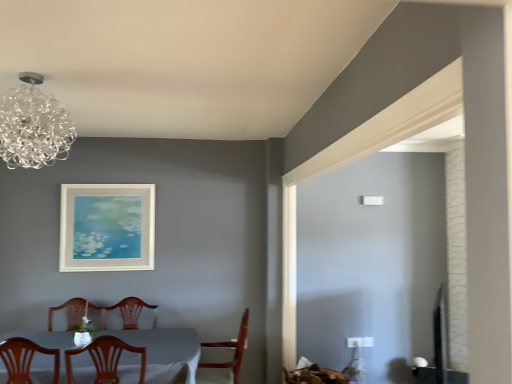
Image resolution: width=512 pixels, height=384 pixels. Find the location of `white glossy table at lower left`. white glossy table at lower left is located at coordinates (165, 353).

The height and width of the screenshot is (384, 512). I want to click on wooden chair at center, marked as the 2th chair in a right-to-left arrangement, so click(105, 359).

What is the approximate height of wooden chair at center, positioned as the first chair in back-to-front order?

wooden chair at center, positioned as the first chair in back-to-front order, is 26.57 inches tall.

Where is `white glossy table at lower left`? white glossy table at lower left is located at coordinates (165, 353).

Is wooden chair at center, positioned as the first chair in back-to-front order, smaller than transparent glass chandelier at upper left?

No, wooden chair at center, positioned as the first chair in back-to-front order, is not smaller than transparent glass chandelier at upper left.

Considering the relative positions of wooden chair at center, placed as the first chair when sorted from right to left, and transparent glass chandelier at upper left in the image provided, is wooden chair at center, placed as the first chair when sorted from right to left, to the right of transparent glass chandelier at upper left from the viewer's perspective?

Yes, wooden chair at center, placed as the first chair when sorted from right to left, is to the right of transparent glass chandelier at upper left.

Looking at this image, is there a large distance between wooden chair at center, positioned as the first chair in back-to-front order, and transparent glass chandelier at upper left?

That's right, there is a large distance between wooden chair at center, positioned as the first chair in back-to-front order, and transparent glass chandelier at upper left.

Who is smaller, wooden chair at center, placed as the first chair when sorted from right to left, or white matte picture frame at upper center?

Smaller between the two is white matte picture frame at upper center.

From the image's perspective, between wooden chair at center, acting as the 2th chair starting from the left, and white matte picture frame at upper center, who is located below?

wooden chair at center, acting as the 2th chair starting from the left, appears lower in the image.

Is wooden chair at center, acting as the second chair starting from the front, further to camera compared to white matte picture frame at upper center?

That is False.

Does wooden chair at center, marked as the 2th chair in a right-to-left arrangement, turn towards white glossy table at lower left?

Yes.

Is wooden chair at center, the 1th chair positioned from the front, positioned far away from white glossy table at lower left?

Actually, wooden chair at center, the 1th chair positioned from the front, and white glossy table at lower left are a little close together.

Can you confirm if wooden chair at center, the 1th chair when ordered from left to right, is smaller than white glossy table at lower left?

Yes, wooden chair at center, the 1th chair when ordered from left to right, is smaller than white glossy table at lower left.

Where is `table on the left of wooden chair at center, the 1th chair when ordered from left to right`? table on the left of wooden chair at center, the 1th chair when ordered from left to right is located at coordinates (165, 353).

Does point (79, 377) appear closer or farther from the camera than point (24, 98)?

Clearly, point (79, 377) is more distant from the camera than point (24, 98).

Does white glossy table at lower left come behind transparent glass chandelier at upper left?

Yes, white glossy table at lower left is further from the camera.

Is white glossy table at lower left inside or outside of transparent glass chandelier at upper left?

white glossy table at lower left is located beyond the bounds of transparent glass chandelier at upper left.

Looking at the image, does transparent glass chandelier at upper left seem bigger or smaller compared to white matte picture frame at upper center?

Considering their sizes, transparent glass chandelier at upper left takes up more space than white matte picture frame at upper center.

Can we say transparent glass chandelier at upper left lies outside white matte picture frame at upper center?

transparent glass chandelier at upper left is positioned outside white matte picture frame at upper center.

This screenshot has width=512, height=384. In order to click on lamp above the white matte picture frame at upper center (from the image's perspective) in this screenshot , I will do `click(33, 126)`.

Who is taller, transparent glass chandelier at upper left or white matte picture frame at upper center?

white matte picture frame at upper center is taller.

From a real-world perspective, which object stands above the other?

wooden chair at center, acting as the second chair starting from the front.

The width and height of the screenshot is (512, 384). In order to click on table below the wooden chair at center, acting as the 2th chair starting from the left (from a real-world perspective) in this screenshot , I will do `click(165, 353)`.

Based on their sizes in the image, would you say white glossy table at lower left is bigger or smaller than wooden chair at center, positioned as the first chair in back-to-front order?

In the image, white glossy table at lower left appears to be larger than wooden chair at center, positioned as the first chair in back-to-front order.

Is white glossy table at lower left far from wooden chair at center, acting as the second chair starting from the front?

white glossy table at lower left is actually quite close to wooden chair at center, acting as the second chair starting from the front.

Which object is wider, transparent glass chandelier at upper left or white glossy table at lower left?

white glossy table at lower left.

Could you tell me if transparent glass chandelier at upper left is facing white glossy table at lower left?

No, transparent glass chandelier at upper left is not aimed at white glossy table at lower left.

Does transparent glass chandelier at upper left have a larger size compared to white glossy table at lower left?

No.

Which is more to the left, transparent glass chandelier at upper left or white glossy table at lower left?

white glossy table at lower left.

Find the location of `the 2nd chair below when counting from the transparent glass chandelier at upper left (from the image's perspective)`. the 2nd chair below when counting from the transparent glass chandelier at upper left (from the image's perspective) is located at coordinates (225, 362).

The width and height of the screenshot is (512, 384). Identify the location of picture frame behind the wooden chair at center, acting as the second chair starting from the front. (106, 227).

From the image, which object appears to be nearer to white matte picture frame at upper center, wooden chair at center, the second chair viewed from the back, or wooden chair at center, placed as the first chair when sorted from right to left?

The object closer to white matte picture frame at upper center is wooden chair at center, placed as the first chair when sorted from right to left.

Based on the photo, looking at the image, which one is located further to transparent glass chandelier at upper left, white matte picture frame at upper center or white glossy table at lower left?

white matte picture frame at upper center is positioned further to the anchor transparent glass chandelier at upper left.

Considering their positions, is white glossy table at lower left positioned further to wooden chair at center, acting as the 2th chair starting from the left, than wooden chair at center, the 1th chair positioned from the front?

wooden chair at center, the 1th chair positioned from the front, lies further to wooden chair at center, acting as the 2th chair starting from the left, than the other object.

Considering their positions, is white glossy table at lower left positioned closer to transparent glass chandelier at upper left than white matte picture frame at upper center?

Based on the image, white glossy table at lower left appears to be nearer to transparent glass chandelier at upper left.

Looking at the image, which one is located closer to wooden chair at center, positioned as the first chair in back-to-front order, transparent glass chandelier at upper left or white glossy table at lower left?

The object closer to wooden chair at center, positioned as the first chair in back-to-front order, is white glossy table at lower left.

Estimate the real-world distances between objects in this image. Which object is further from wooden chair at center, acting as the second chair starting from the front, white glossy table at lower left or white matte picture frame at upper center?

white matte picture frame at upper center lies further to wooden chair at center, acting as the second chair starting from the front, than the other object.

Based on their spatial positions, is white glossy table at lower left or transparent glass chandelier at upper left closer to white matte picture frame at upper center?

Among the two, white glossy table at lower left is located nearer to white matte picture frame at upper center.

Looking at this image, based on their spatial positions, is wooden chair at center, the 1th chair positioned from the front, or white glossy table at lower left further from transparent glass chandelier at upper left?

white glossy table at lower left is further to transparent glass chandelier at upper left.

Where is `chair positioned between white glossy table at lower left and white matte picture frame at upper center from near to far`? chair positioned between white glossy table at lower left and white matte picture frame at upper center from near to far is located at coordinates (225, 362).

You are a GUI agent. You are given a task and a screenshot of the screen. Output one action in this format:
    pyautogui.click(x=<x>, y=<y>)
    Task: Click on the chair between wooden chair at center, marked as the 2th chair in a right-to-left arrangement, and white matte picture frame at upper center in the front-back direction
    
    Given the screenshot: What is the action you would take?
    pyautogui.click(x=225, y=362)

Identify the location of chair between white glossy table at lower left and wooden chair at center, acting as the second chair starting from the front. (105, 359).

Locate an element on the screen. The height and width of the screenshot is (384, 512). table between wooden chair at center, the 1th chair when ordered from left to right, and white matte picture frame at upper center in the front-back direction is located at coordinates coord(165,353).